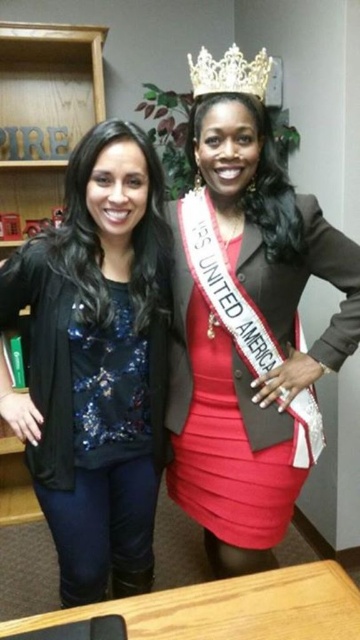
You are organizing an event and need to decide whether the satin red dress at center can fit on the wooden bookshelf at left. Based on their sizes, will the dress fit?

The satin red dress at center occupies less space than the wooden bookshelf at left, so the dress can fit on the bookshelf.

You are standing in an office and want to place a small potted plant at point (228, 449). The plant requires a space that is at least 1.5 meters away from the camera to avoid blocking the view. Will this placement work?

The distance of point (228, 449) from camera is 1.44 meters, so placing the plant there will not work because it is too close to the camera, only 1.44 meters away, which is less than the required 1.5 meters.

In the scene shown: You are a photographer setting up for a portrait. You need to focus on the gold metallic crown at upper center and the satin red dress at center. Which object should you adjust your camera focus to first to ensure both are in sharp focus?

The satin red dress at center is closer to the viewer than the gold metallic crown at upper center, so you should focus on the gold metallic crown at upper center first to ensure both are in sharp focus.